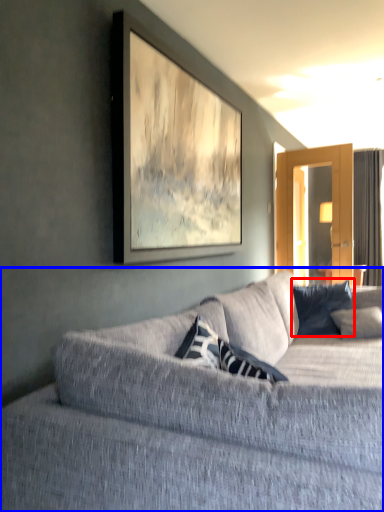
Question: Which of the following is the farthest to the observer, pillow (highlighted by a red box) or studio couch (highlighted by a blue box)?

Choices:
 (A) pillow
 (B) studio couch

Answer: (A)